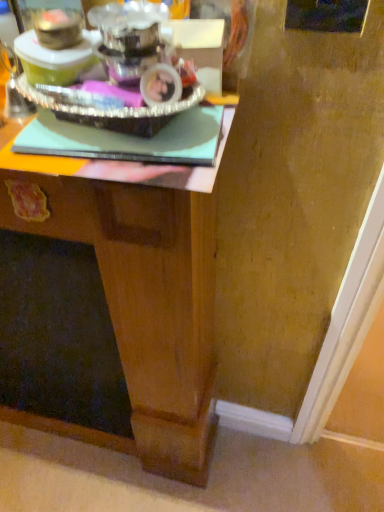
At what (x,y) coordinates should I click in order to perform the action: click on vacant space underneath silver metallic tray at upper left (from a real-world perspective). Please return your answer as a coordinate pair (x, y). The image size is (384, 512). Looking at the image, I should click on (105, 129).